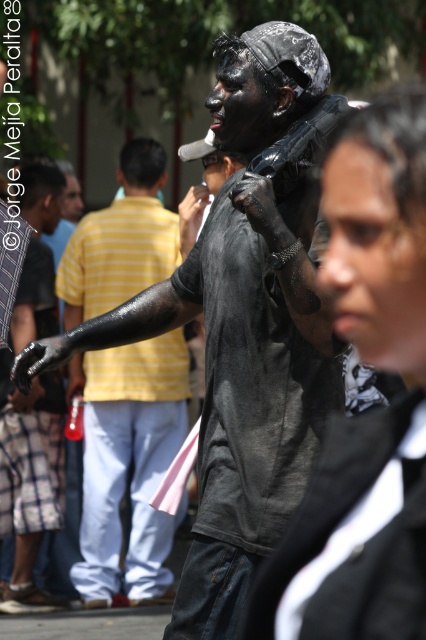
Question: Can you confirm if matte black jacket at center is wider than black matte body at center?

Choices:
 (A) no
 (B) yes

Answer: (A)

Question: Which object is farther from the camera taking this photo?

Choices:
 (A) black matte body at center
 (B) matte black jacket at center

Answer: (A)

Question: Is the position of matte black jacket at center less distant than that of black matte body at center?

Choices:
 (A) no
 (B) yes

Answer: (B)

Question: Is matte black jacket at center to the right of black matte body at center from the viewer's perspective?

Choices:
 (A) yes
 (B) no

Answer: (A)